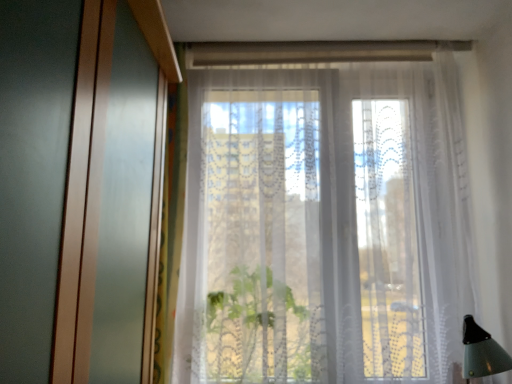
The height and width of the screenshot is (384, 512). Identify the location of transparent lace curtain at center. (325, 223).

What do you see at coordinates (325, 223) in the screenshot? I see `transparent lace curtain at center` at bounding box center [325, 223].

Find the location of a particular element. This screenshot has width=512, height=384. transparent lace curtain at center is located at coordinates (325, 223).